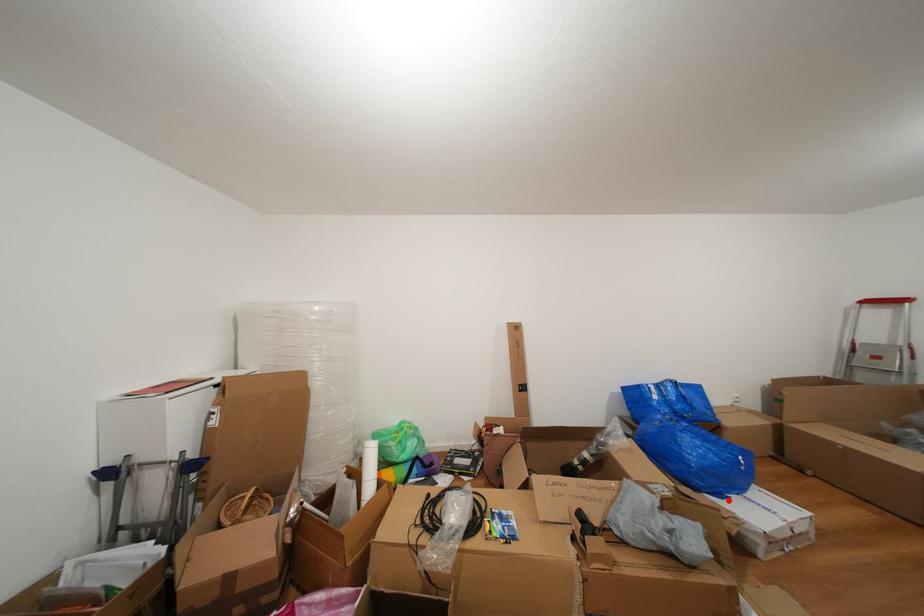
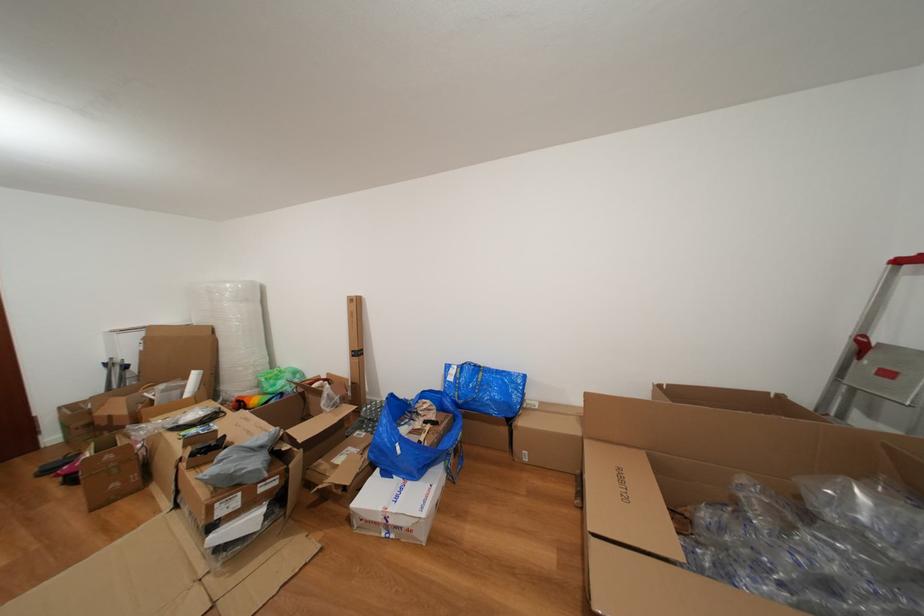
Question: I am providing you with two images of the same scene from different viewpoints. Given a red point in image1, look at the same physical point in image2. Is it:

Choices:
 (A) Closer to the viewpoint
 (B) Farther from the viewpoint

Answer: (B)